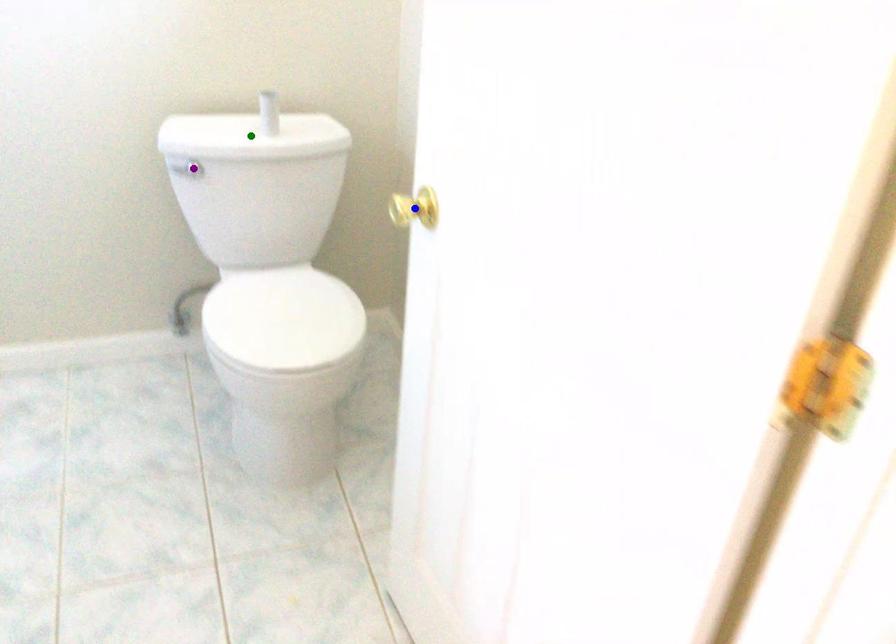
From the picture: Order these from nearest to farthest:
1. blue point
2. green point
3. purple point

blue point, purple point, green point